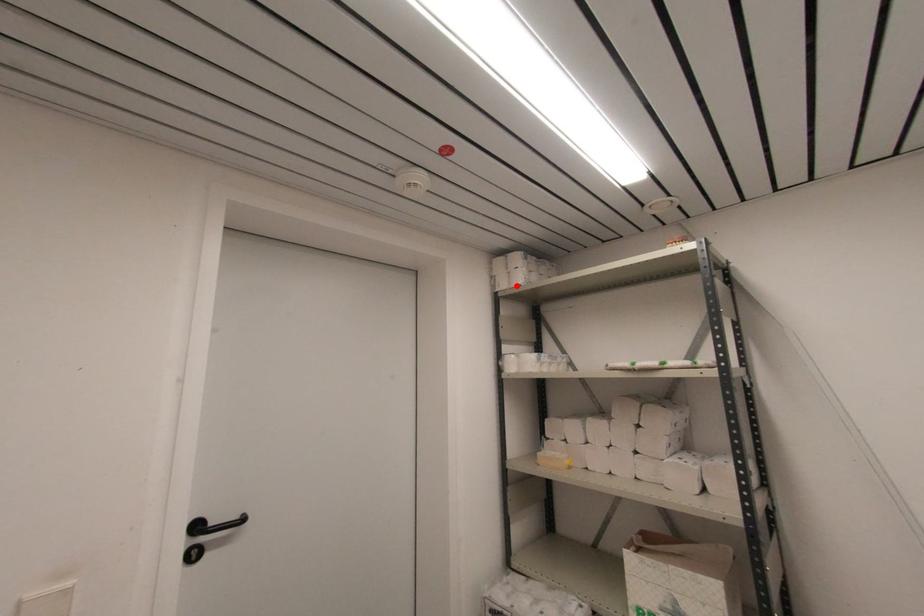
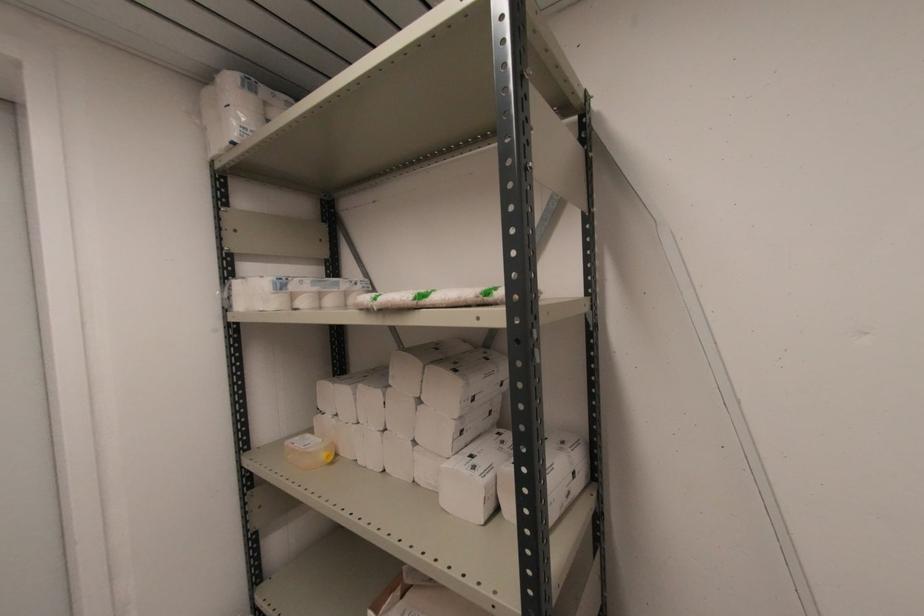
Question: I am providing you with two images of the same scene from different viewpoints. A red point is marked on the first image. At the location where the point appears in image 1, is it still visible in image 2?

Choices:
 (A) Yes
 (B) No

Answer: (A)